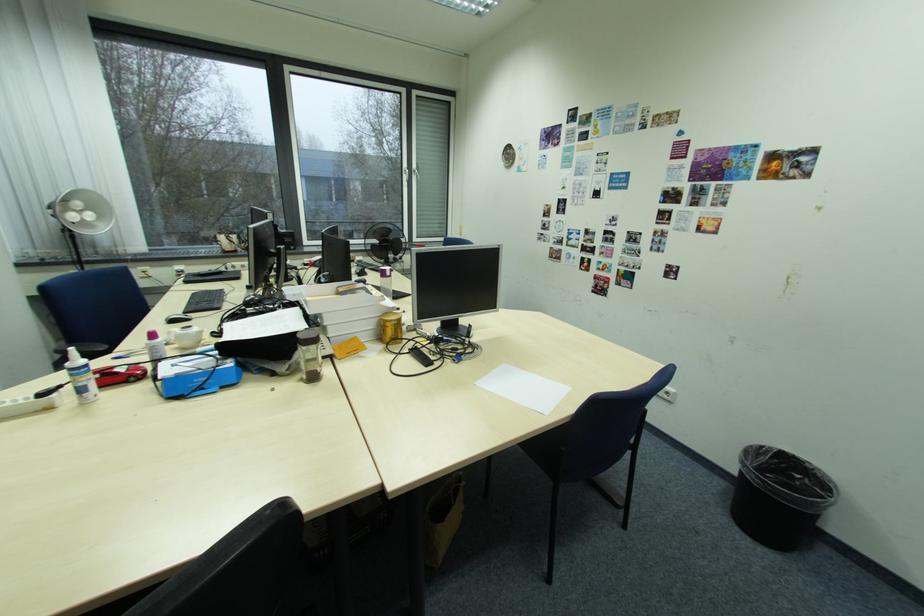
At what (x,y) coordinates should I click in order to perform the action: click on white spray bottle. Please return your answer as a coordinate pair (x, y). The width and height of the screenshot is (924, 616). Looking at the image, I should click on (80, 377).